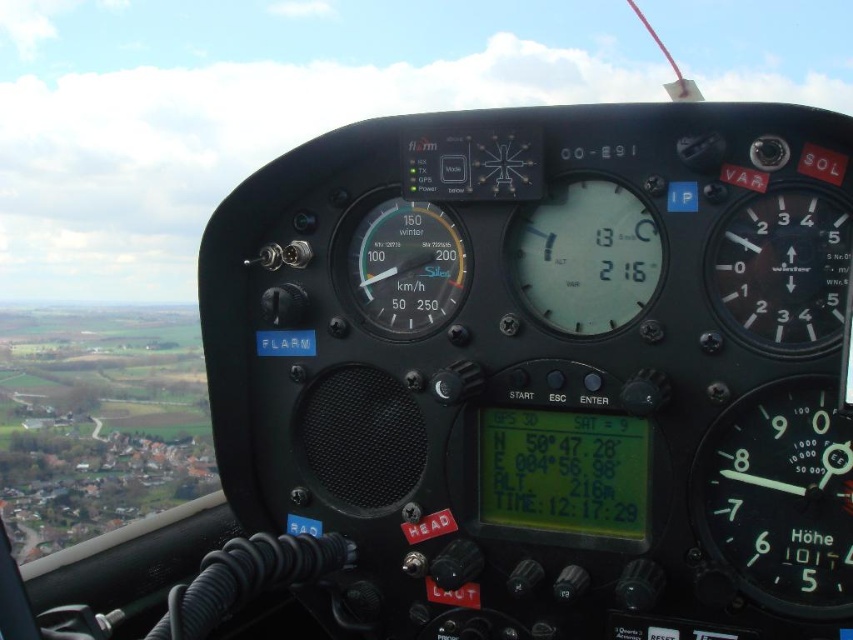
Question: Which point is farther to the camera?

Choices:
 (A) (373, 250)
 (B) (769, 240)
 (C) (601, 321)
 (D) (840, 524)

Answer: (A)

Question: Which object is positioned closest to the black matte gauge at upper right?

Choices:
 (A) transparent glass altimeter at center
 (B) white illuminated needle at right

Answer: (B)

Question: Which point is closer to the camera?

Choices:
 (A) (526, 288)
 (B) (405, 314)

Answer: (A)

Question: Does white illuminated needle at right appear over transparent glass altimeter at center?

Choices:
 (A) yes
 (B) no

Answer: (B)

Question: Does white illuminated needle at right appear under matte black speedometer at center?

Choices:
 (A) no
 (B) yes

Answer: (B)

Question: Does transparent glass altimeter at center have a larger size compared to matte black speedometer at center?

Choices:
 (A) no
 (B) yes

Answer: (B)